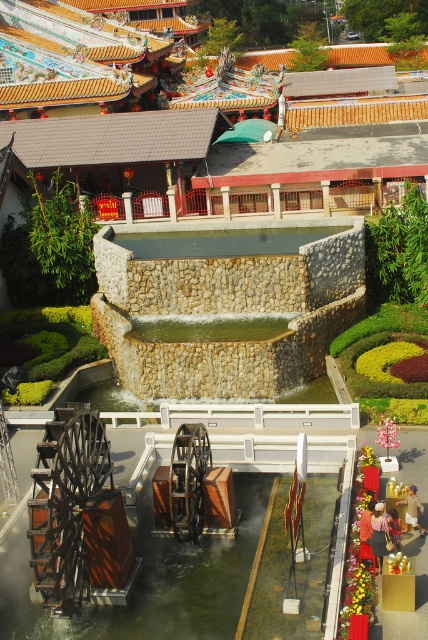
Question: Which point appears closest to the camera in this image?

Choices:
 (A) (6, 628)
 (B) (142, 276)

Answer: (A)

Question: Does stone textured fountain at center have a greater width compared to matte brown temple at upper center?

Choices:
 (A) no
 (B) yes

Answer: (A)

Question: Among these points, which one is farthest from the camera?

Choices:
 (A) (134, 344)
 (B) (32, 10)

Answer: (B)

Question: Which object is positioned farthest from the matte brown temple at upper center?

Choices:
 (A) wooden waterwheel at lower center
 (B) stone textured fountain at center

Answer: (A)

Question: Can you confirm if matte brown temple at upper center is positioned above wooden waterwheel at lower center?

Choices:
 (A) yes
 (B) no

Answer: (A)

Question: Does matte brown temple at upper center appear on the right side of wooden waterwheel at lower center?

Choices:
 (A) no
 (B) yes

Answer: (B)